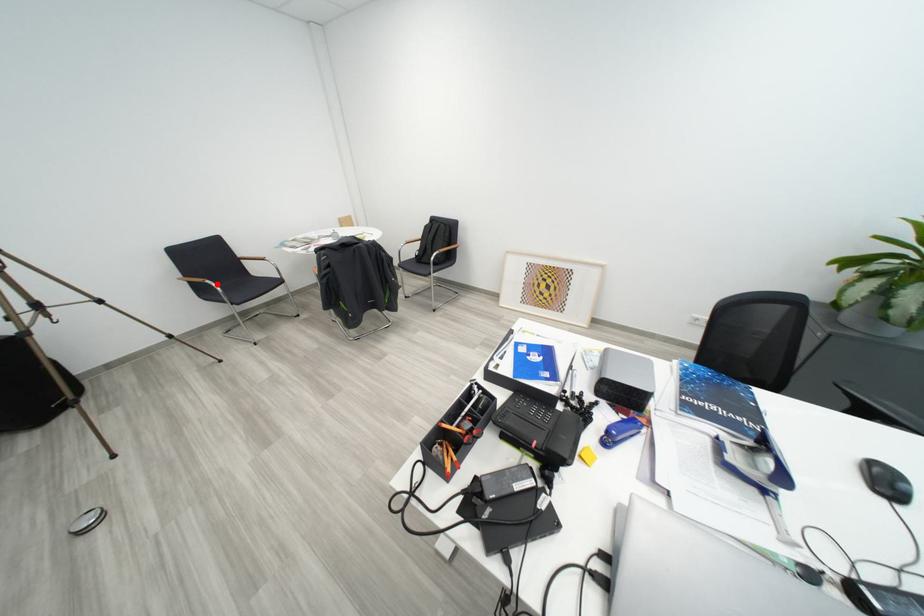
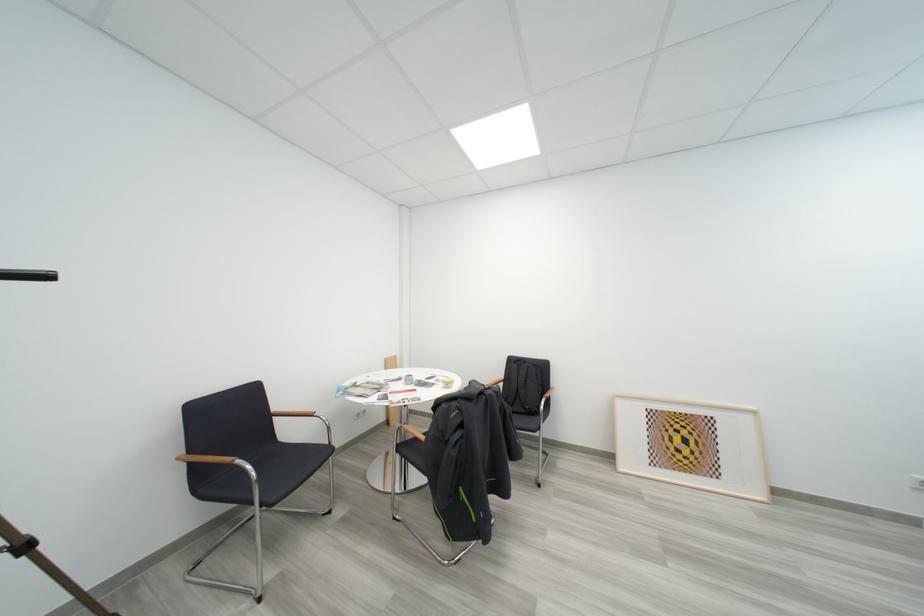
Find the pixel in the second image that matches the highlighted location in the first image.

(247, 464)